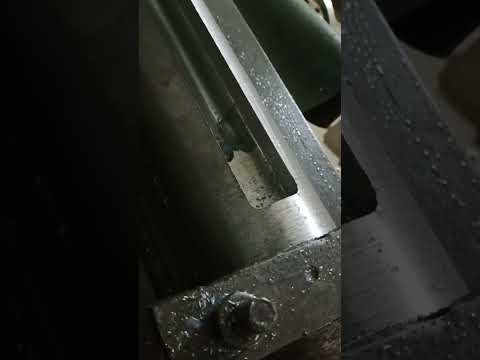
Where is `countertop`? Image resolution: width=480 pixels, height=360 pixels. countertop is located at coordinates (x=427, y=79).